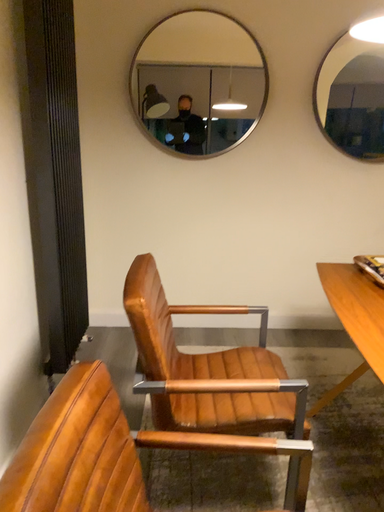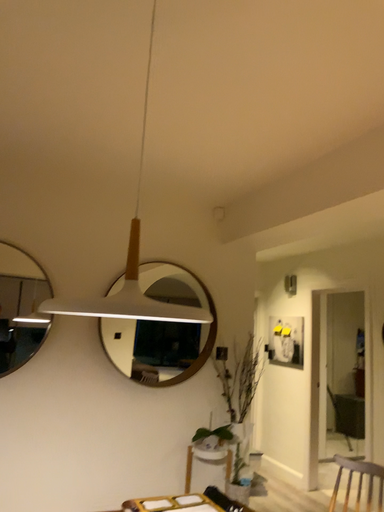
Question: Which way did the camera rotate in the video?

Choices:
 (A) rotated left
 (B) rotated right

Answer: (B)